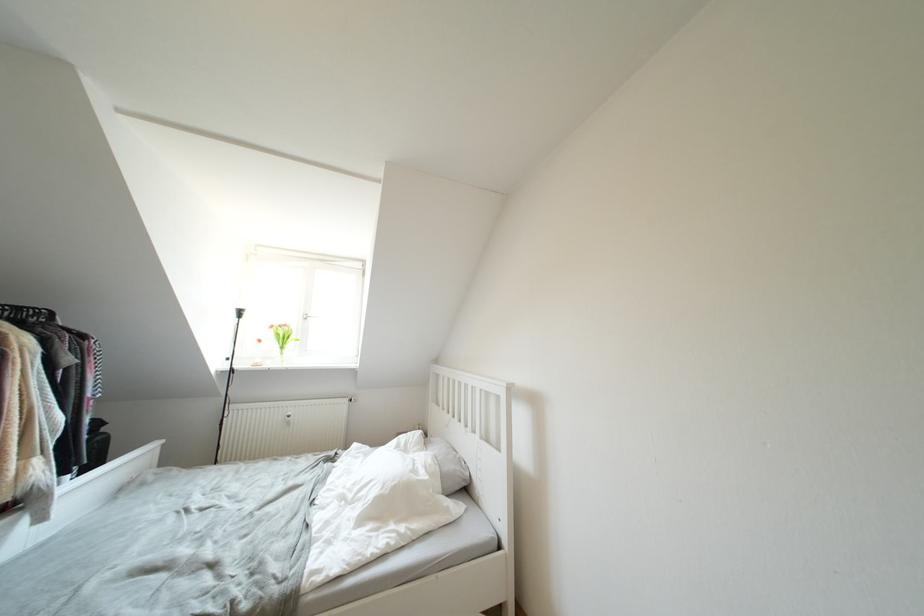
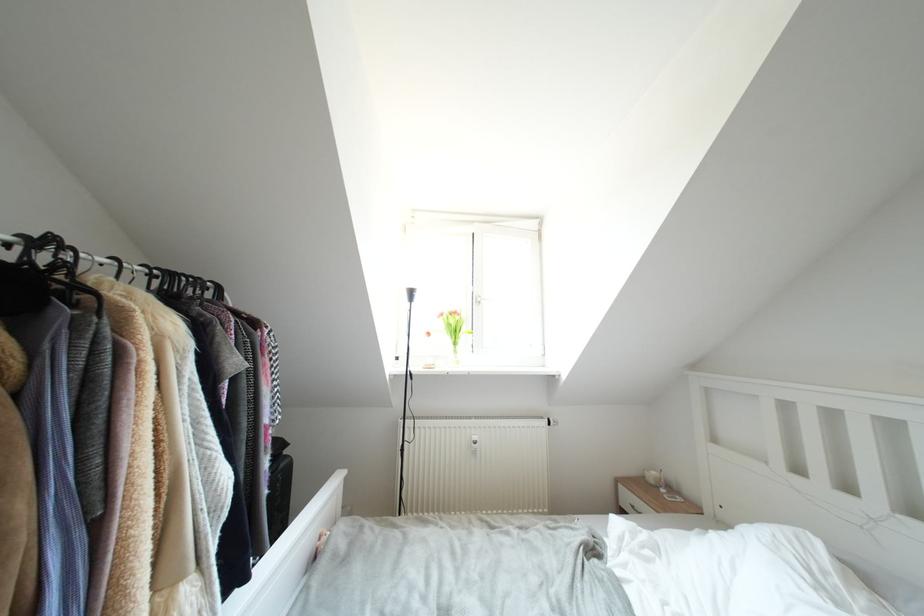
Which direction would the cameraman need to move to produce the second image?

The cameraman moved toward left, forward.